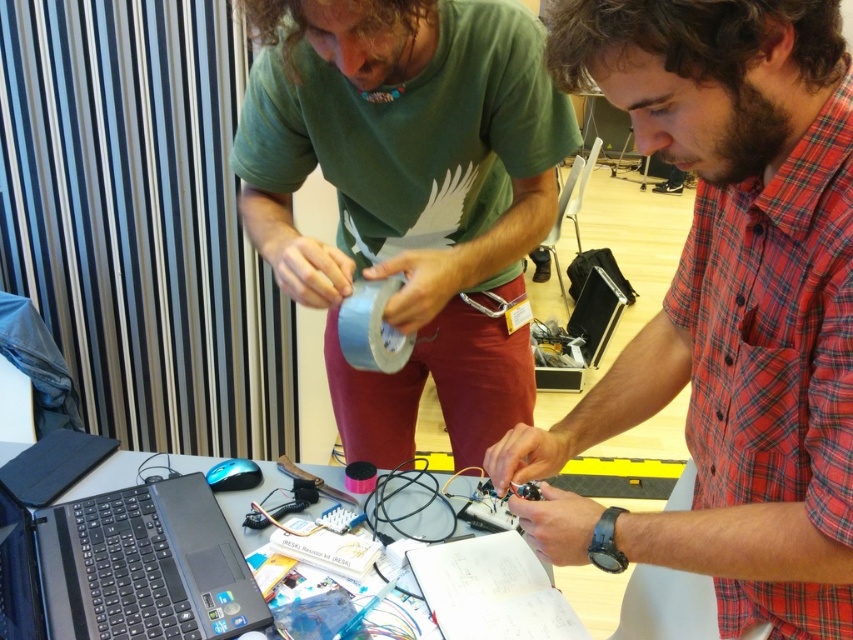
Can you confirm if black plastic table at center is positioned to the right of black matte wire at center?

No, black plastic table at center is not to the right of black matte wire at center.

From the picture: Can you confirm if black plastic table at center is taller than black matte wire at center?

Yes, black plastic table at center is taller than black matte wire at center.

Measure the distance between black plastic table at center and camera.

black plastic table at center and camera are 38.44 inches apart from each other.

This screenshot has width=853, height=640. I want to click on black plastic table at center, so click(248, 504).

Does black plastic laptop at lower left have a lesser width compared to black matte wire at center?

Incorrect, black plastic laptop at lower left's width is not less than black matte wire at center's.

Is point (30, 564) behind point (421, 468)?

No.

Is point (45, 611) in front of point (376, 477)?

Yes, it is.

Locate an element on the screen. black plastic laptop at lower left is located at coordinates (125, 566).

Who is more forward, (762, 170) or (267, 612)?

Point (762, 170) is in front.

The height and width of the screenshot is (640, 853). What do you see at coordinates (726, 308) in the screenshot?
I see `red plaid shirt at center` at bounding box center [726, 308].

I want to click on red plaid shirt at center, so click(x=726, y=308).